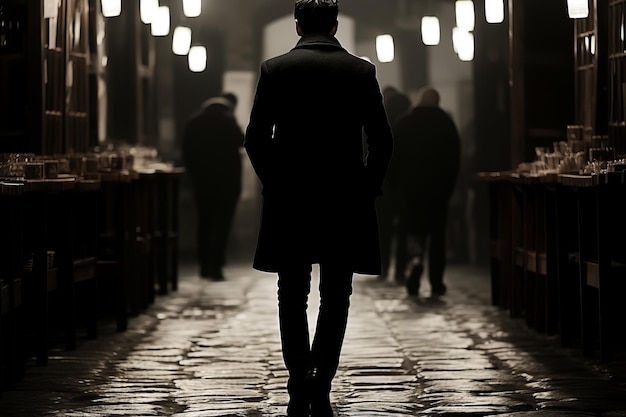
What are the coordinates of `tables` in the screenshot? It's located at (74, 209), (116, 206).